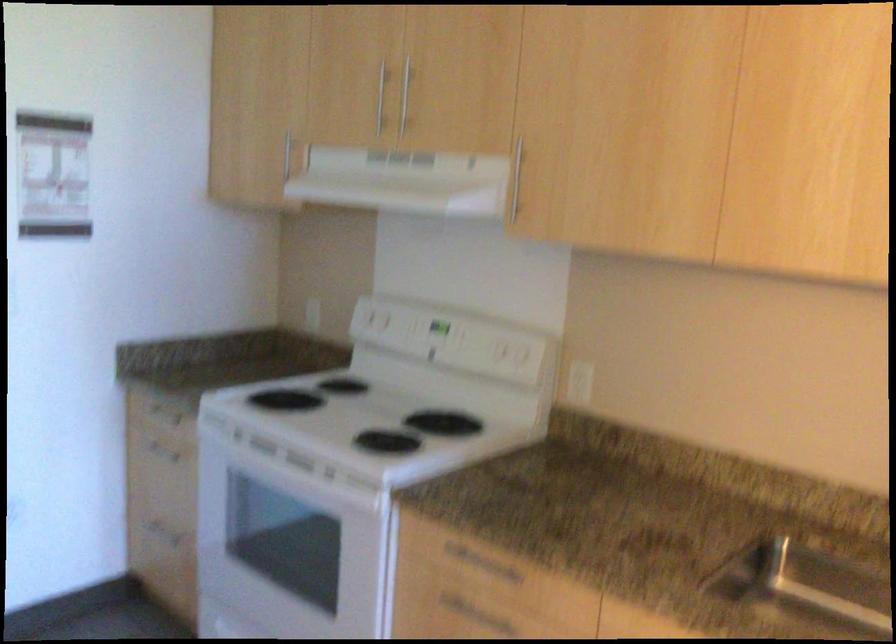
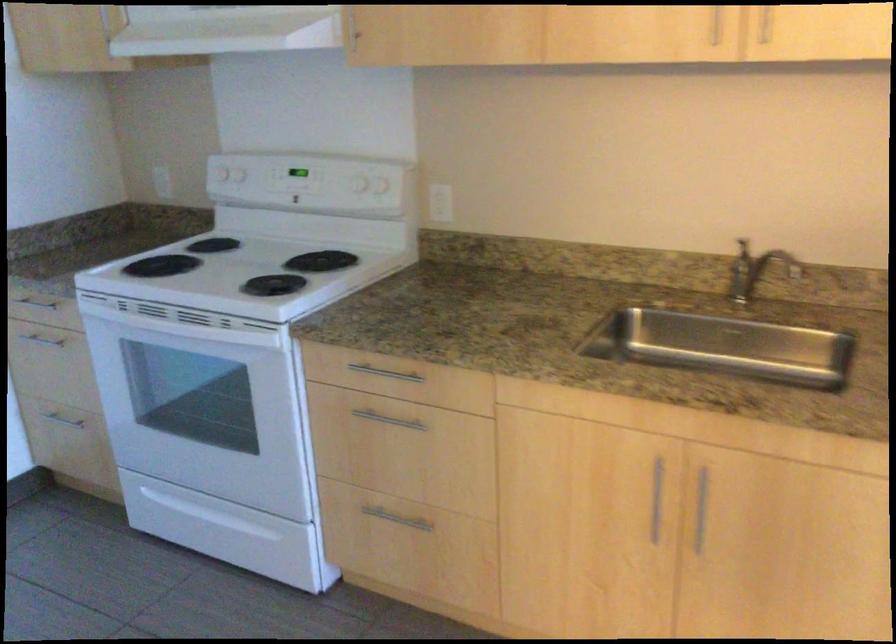
Question: The images are taken continuously from a first-person perspective. In which direction is your viewpoint rotating?

Choices:
 (A) Left
 (B) Right
 (C) Up
 (D) Down

Answer: (D)